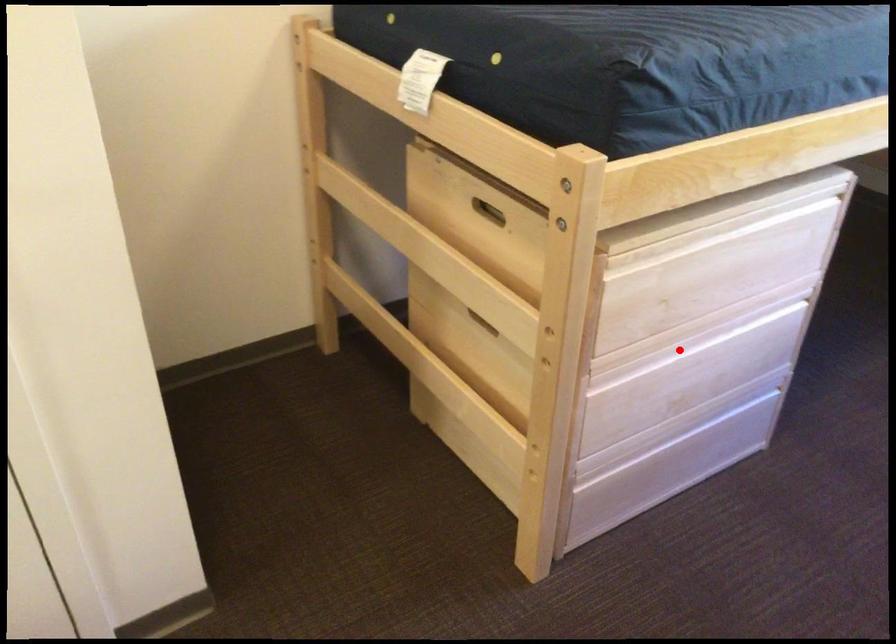
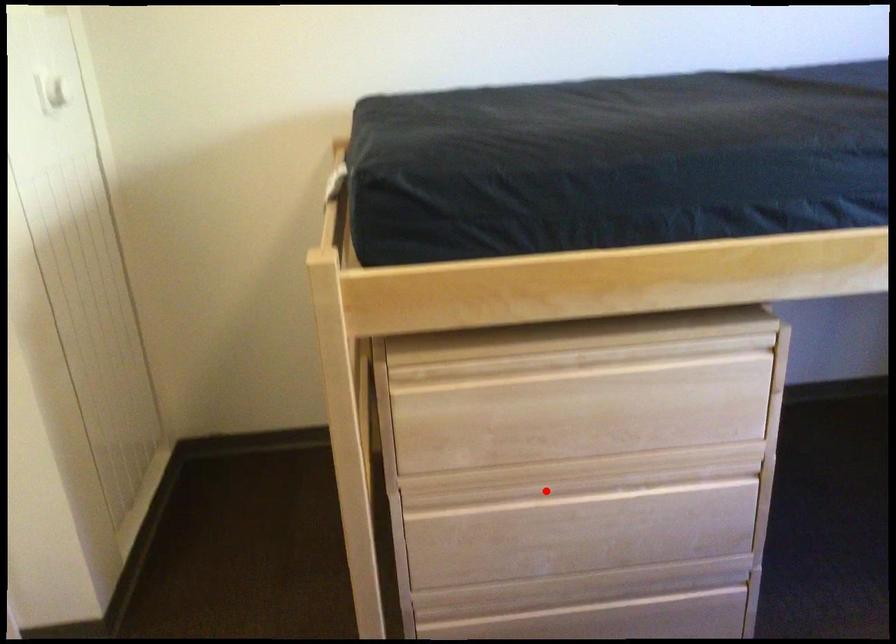
I am providing you with two images of the same scene from different viewpoints. A red point is marked on the first image and another point is marked on the second image. Is the red point in image1 aligned with the point shown in image2?

Yes